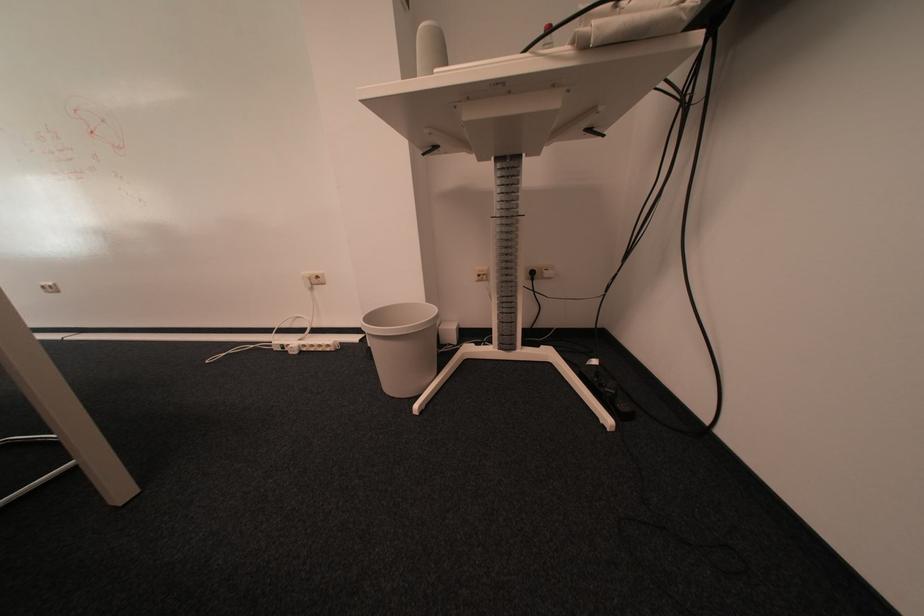
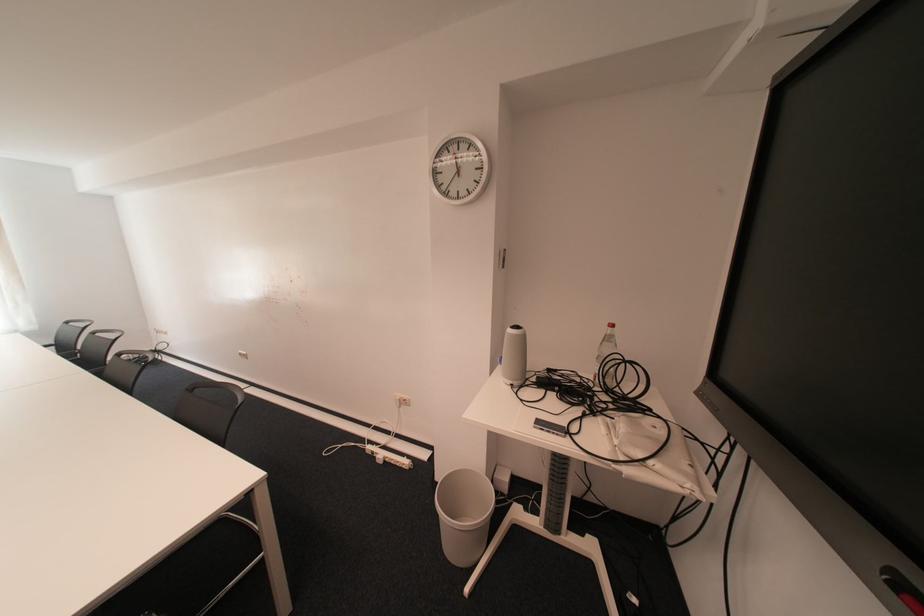
Locate, in the second image, the point that corresponds to [393,390] in the first image.

(453, 546)